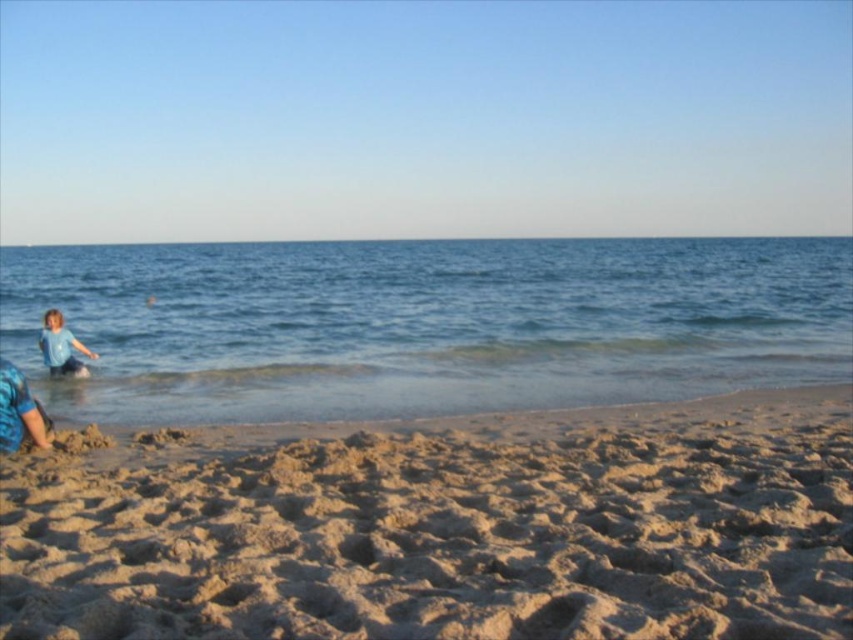
Which is behind, point (500, 588) or point (39, 346)?

Positioned behind is point (39, 346).

Does fine-grained sand at lower center come in front of light blue fabric shirt at left?

Yes, it is in front of light blue fabric shirt at left.

Which is behind, point (138, 628) or point (57, 348)?

Point (57, 348)

Identify the location of fine-grained sand at lower center. (444, 528).

Can you confirm if blue liquid water at left is shorter than light blue fabric shirt at left?

In fact, blue liquid water at left may be taller than light blue fabric shirt at left.

Which is above, blue liquid water at left or light blue fabric shirt at left?

blue liquid water at left is above.

Is point (236, 358) positioned in front of point (83, 365)?

No, it is behind (83, 365).

The image size is (853, 640). I want to click on blue liquid water at left, so click(425, 323).

Does fine-grained sand at lower center have a lesser width compared to blue liquid water at left?

Yes.

Can you confirm if fine-grained sand at lower center is positioned below blue liquid water at left?

Correct, fine-grained sand at lower center is located below blue liquid water at left.

Locate an element on the screen. fine-grained sand at lower center is located at coordinates (444, 528).